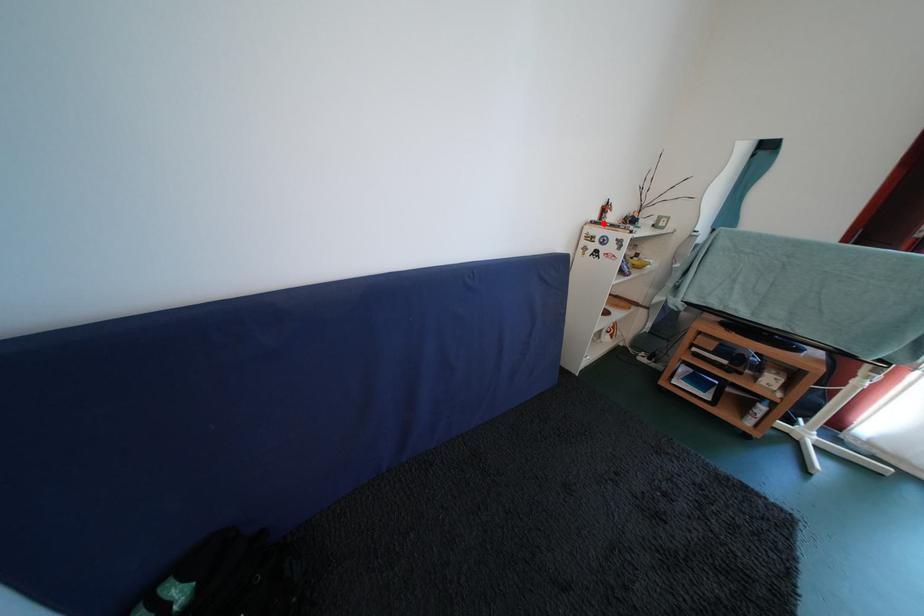
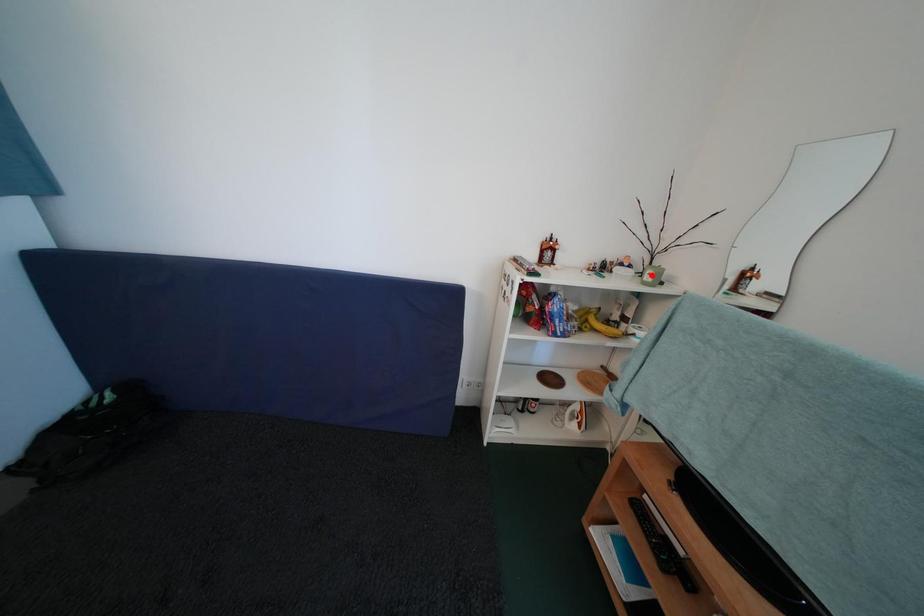
I am providing you with two images of the same scene from different viewpoints. A red point is marked on the first image and another point is marked on the second image. Is the marked point in image1 the same physical position as the marked point in image2?

No